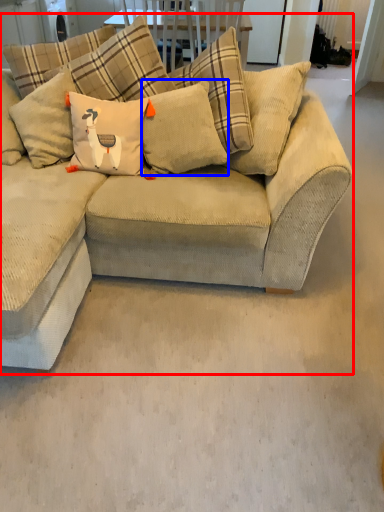
Question: Which object is further to the camera taking this photo, studio couch (highlighted by a red box) or pillow (highlighted by a blue box)?

Choices:
 (A) studio couch
 (B) pillow

Answer: (B)